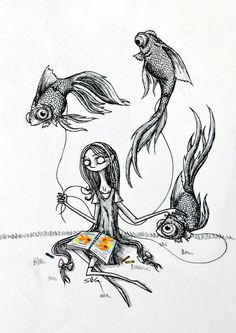
Where is `book`? This screenshot has height=333, width=236. book is located at coordinates (81, 238), (101, 243).